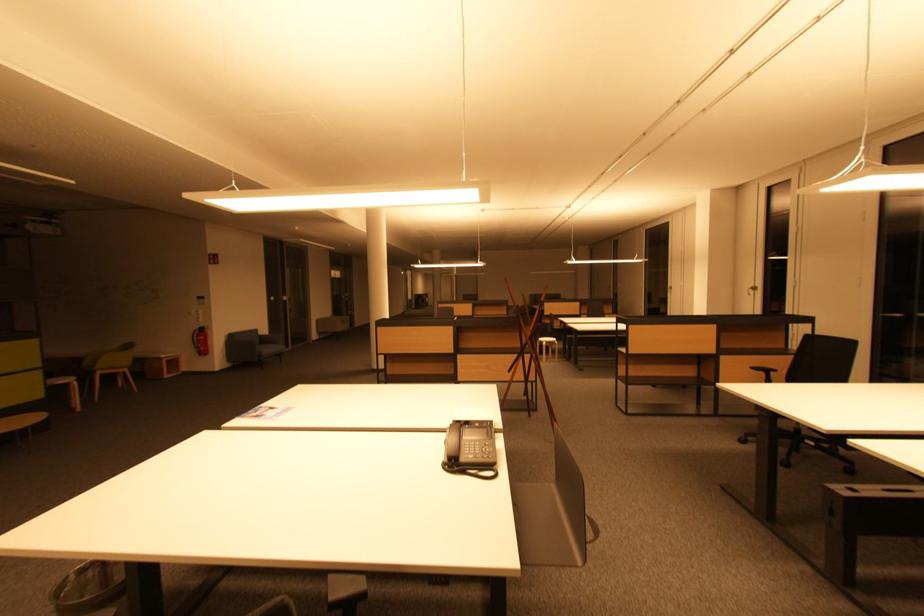
Where is `telephone handset`? The image size is (924, 616). telephone handset is located at coordinates (453, 446).